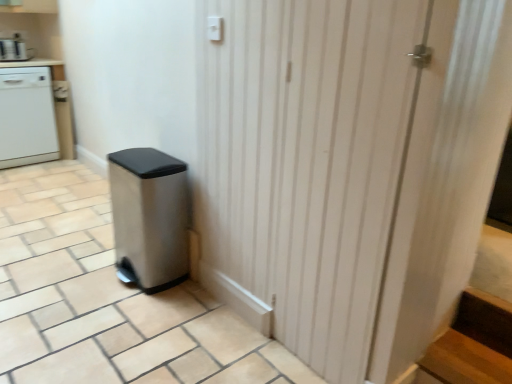
Image resolution: width=512 pixels, height=384 pixels. Identify the location of vacant space in front of stainless steel trash can at lower left. (125, 317).